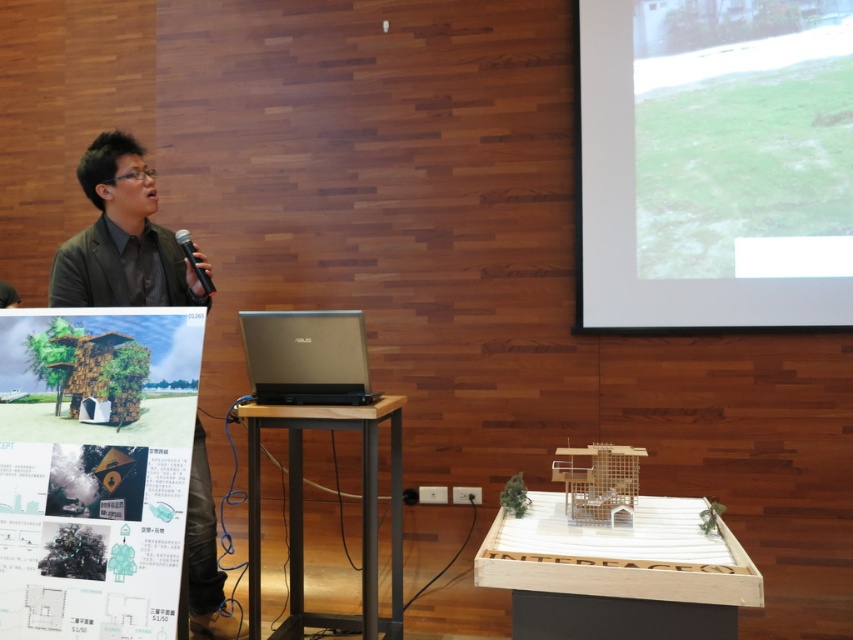
You are organizing a small outdoor event and need to decide where to place a 3m wide tent. The tent must be placed either on the green grass at upper right or the wooden podium at center. Based on the space available, which location can accommodate the tent?

The green grass at upper right has a greater width than the wooden podium at center, so the tent can be placed on the green grass at upper right.